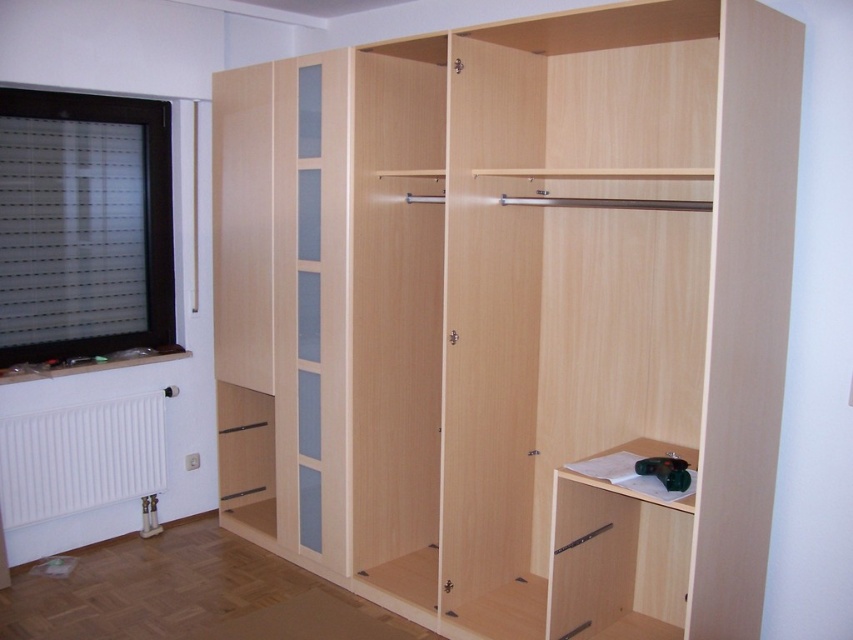
Between light wood closet at center and white matte radiator at lower left, which one has more height?

light wood closet at center

Which of these two, light wood closet at center or white matte radiator at lower left, stands shorter?

Standing shorter between the two is white matte radiator at lower left.

Is point (459, 580) positioned in front of point (120, 404)?

Yes, it is in front of point (120, 404).

Locate an element on the screen. The width and height of the screenshot is (853, 640). light wood closet at center is located at coordinates (525, 300).